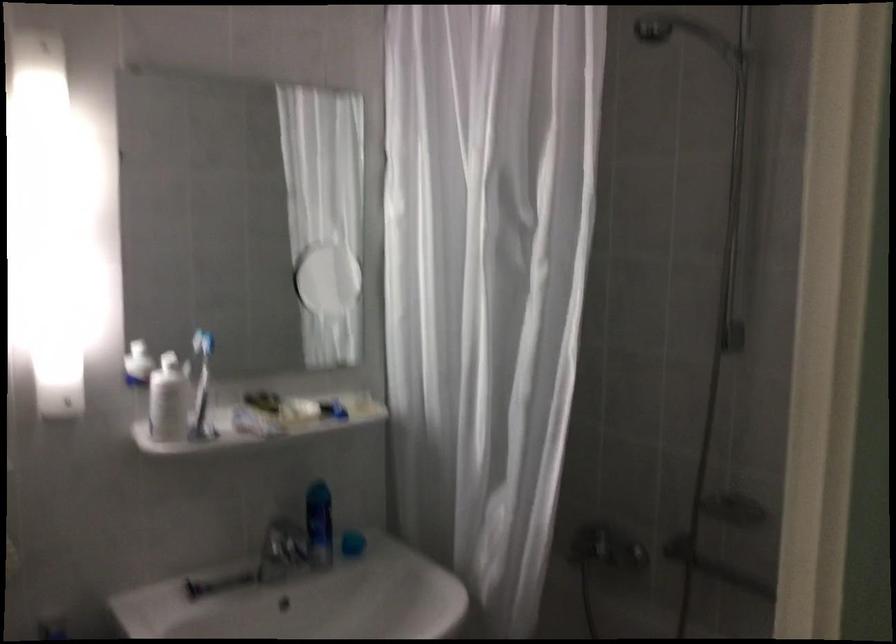
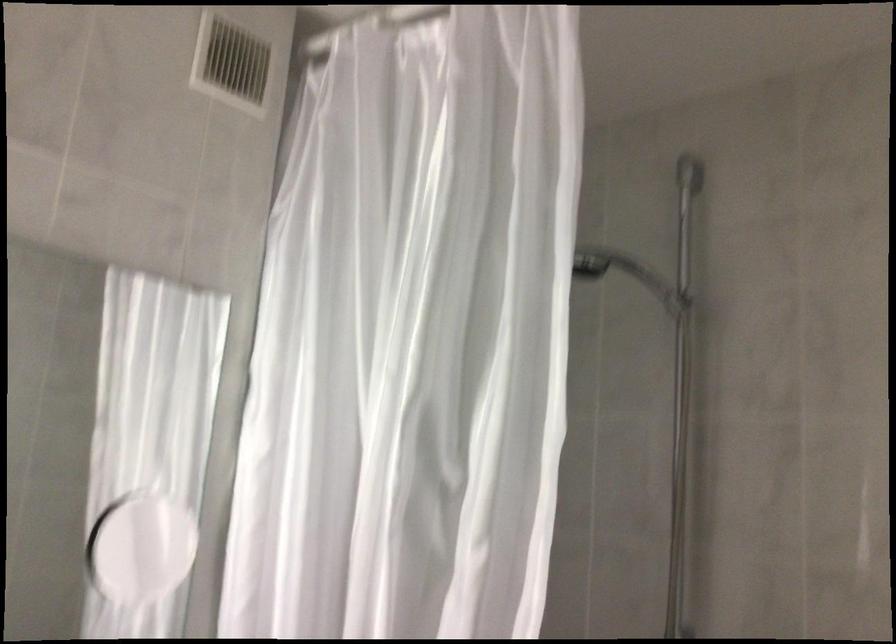
Find the pixel in the second image that matches (487,114) in the first image.

(412, 337)